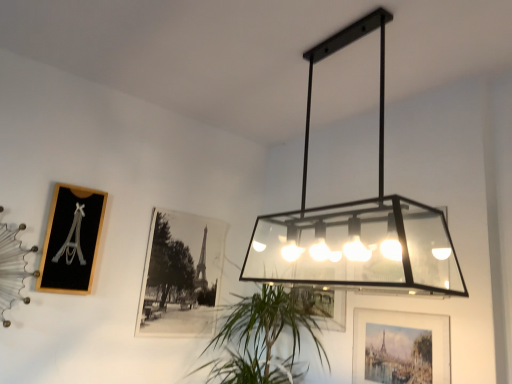
Question: From their relative heights in the image, would you say black matte photo frame at center, the 2th picture frame when ordered from left to right, is taller or shorter than black wood picture frame at left, which appears as the 1th picture frame when viewed from the left?

Choices:
 (A) tall
 (B) short

Answer: (A)

Question: Considering the positions of black matte photo frame at center, the 2th picture frame when ordered from left to right, and black wood picture frame at left, which appears as the 1th picture frame when viewed from the left, in the image, is black matte photo frame at center, the 2th picture frame when ordered from left to right, bigger or smaller than black wood picture frame at left, which appears as the 1th picture frame when viewed from the left,?

Choices:
 (A) big
 (B) small

Answer: (A)

Question: Which object is positioned farthest from the matte black rectangular light fixture at upper center?

Choices:
 (A) green leafy plant at center
 (B) black wood picture frame at left, which appears as the 1th picture frame when viewed from the left
 (C) black matte photo frame at center, the 2th picture frame when ordered from left to right
 (D) matte glass picture frame at lower right, which ranks as the first picture frame in right-to-left order

Answer: (B)

Question: Which of these objects is positioned closest to the matte glass picture frame at lower right, positioned as the third picture frame in left-to-right order?

Choices:
 (A) matte black rectangular light fixture at upper center
 (B) green leafy plant at center
 (C) black wood picture frame at left, which appears as the 3th picture frame when viewed from the right
 (D) black matte photo frame at center, which is counted as the second picture frame, starting from the right

Answer: (B)